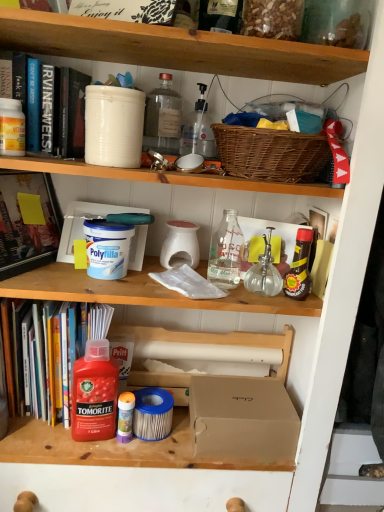
Question: Is translucent plastic glue stick at lower center, positioned as the second bottle in left-to-right order, facing away from clear glass bottle at center, the fifth bottle when ordered from left to right?

Choices:
 (A) no
 (B) yes

Answer: (A)

Question: From a real-world perspective, is translucent plastic glue stick at lower center, the sixth bottle when ordered from right to left, physically below clear glass bottle at center, the third bottle positioned from the right?

Choices:
 (A) yes
 (B) no

Answer: (A)

Question: From a real-world perspective, is translucent plastic glue stick at lower center, the sixth bottle when ordered from right to left, physically above clear glass bottle at center, the third bottle positioned from the right?

Choices:
 (A) yes
 (B) no

Answer: (B)

Question: Considering the relative sizes of translucent plastic glue stick at lower center, positioned as the second bottle in left-to-right order, and clear glass bottle at center, the fifth bottle when ordered from left to right, in the image provided, is translucent plastic glue stick at lower center, positioned as the second bottle in left-to-right order, wider than clear glass bottle at center, the fifth bottle when ordered from left to right,?

Choices:
 (A) yes
 (B) no

Answer: (B)

Question: Is translucent plastic glue stick at lower center, the sixth bottle when ordered from right to left, at the left side of clear glass bottle at center, the fifth bottle when ordered from left to right?

Choices:
 (A) yes
 (B) no

Answer: (A)

Question: Is brown cardboard box at center, placed as the second box when sorted from left to right, bigger or smaller than hardcover book at left, placed as the second book when sorted from top to bottom?

Choices:
 (A) big
 (B) small

Answer: (B)

Question: From the image's perspective, relative to hardcover book at left, the 2th book positioned from the bottom, is brown cardboard box at center, placed as the second box when sorted from left to right, above or below?

Choices:
 (A) below
 (B) above

Answer: (A)

Question: Is brown cardboard box at center, which is the 1th box from bottom to top, in front of or behind hardcover book at left, the 2th book positioned from the bottom, in the image?

Choices:
 (A) front
 (B) behind

Answer: (B)

Question: Is point [x=240, y=397] closer or farther from the camera than point [x=8, y=201]?

Choices:
 (A) farther
 (B) closer

Answer: (A)

Question: Is white matte bucket at upper center, which is counted as the 2th bucket, starting from the bottom, wider or thinner than hardcover book at left, acting as the third book starting from the top?

Choices:
 (A) wide
 (B) thin

Answer: (B)

Question: Based on their positions, is white matte bucket at upper center, which is counted as the 2th bucket, starting from the bottom, located to the left or right of hardcover book at left, acting as the third book starting from the top?

Choices:
 (A) right
 (B) left

Answer: (A)

Question: Considering their positions, is white matte bucket at upper center, placed as the second bucket when sorted from top to bottom, located in front of or behind hardcover book at left, acting as the third book starting from the top?

Choices:
 (A) front
 (B) behind

Answer: (A)

Question: In terms of size, does white matte bucket at upper center, which appears as the 1th bucket when viewed from the right, appear bigger or smaller than hardcover book at left, acting as the third book starting from the top?

Choices:
 (A) small
 (B) big

Answer: (A)

Question: Does point (49, 74) appear closer or farther from the camera than point (172, 111)?

Choices:
 (A) farther
 (B) closer

Answer: (B)

Question: From a real-world perspective, relative to transparent glass bottle at upper center, the third bottle when ordered from left to right, is hardcover book at upper left, the 1th book in the top-to-bottom sequence, vertically above or below?

Choices:
 (A) above
 (B) below

Answer: (B)